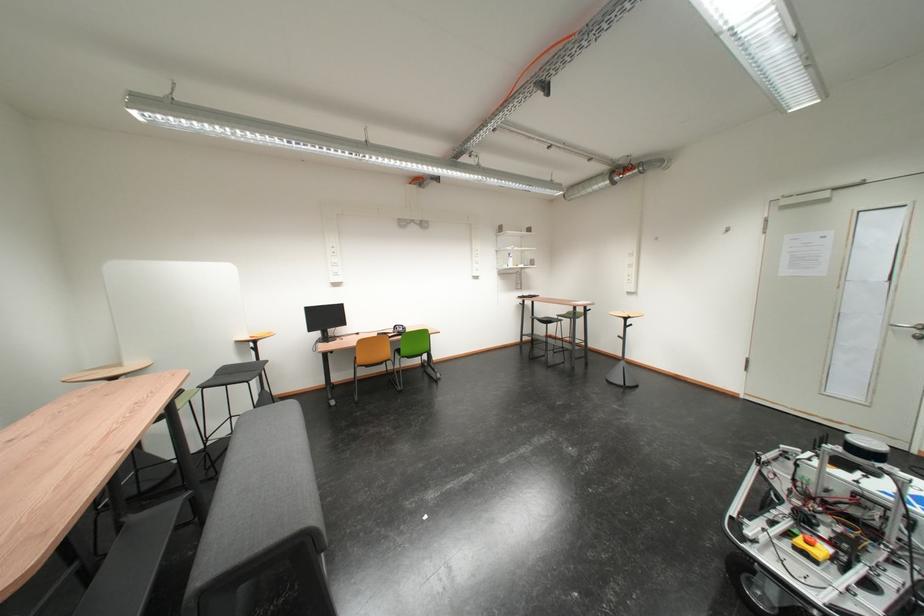
Find where to pull the silver door handle. Please return your answer as a coordinate pair (x, y).

(910, 329)